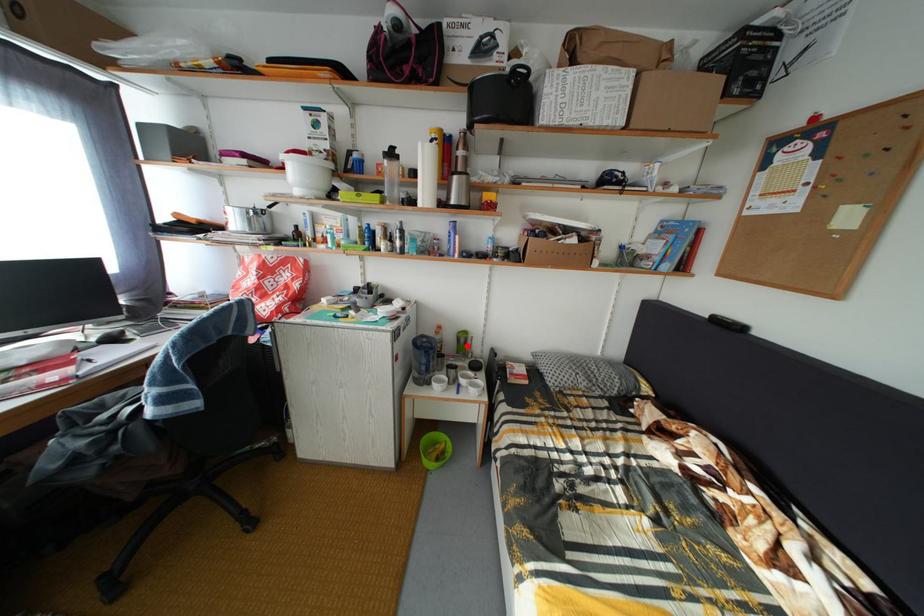
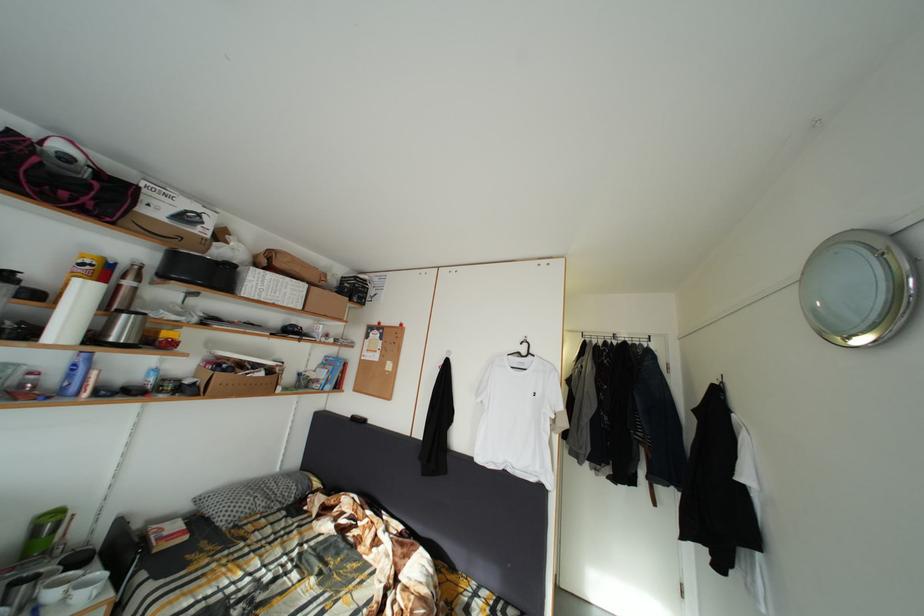
Locate, in the second image, the point that corresponds to the highlighted location in the first image.

(44, 537)